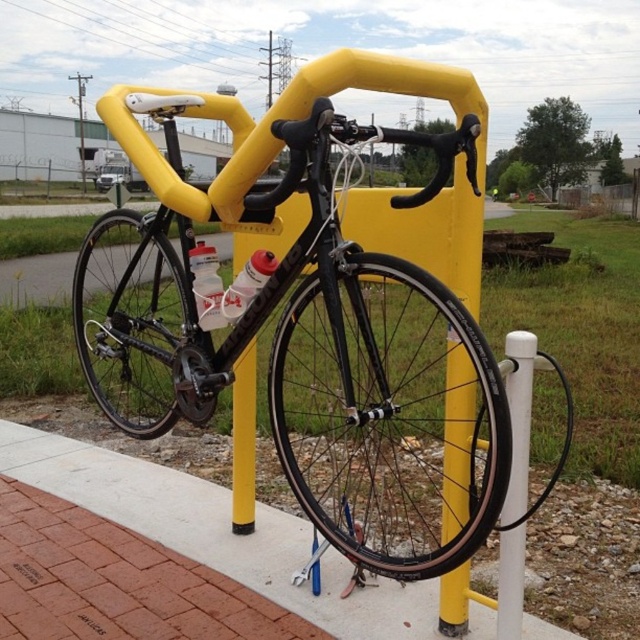
Who is positioned more to the left, matte black bicycle at center or white matte bottle at center?

white matte bottle at center is more to the left.

Can you confirm if matte black bicycle at center is thinner than white matte bottle at center?

Incorrect, matte black bicycle at center's width is not less than white matte bottle at center's.

This screenshot has height=640, width=640. Find the location of `matte black bicycle at center`. matte black bicycle at center is located at coordinates (312, 352).

Which is more to the left, matte black bicycle at center or concrete at lower left?

Positioned to the left is concrete at lower left.

Is matte black bicycle at center bigger than concrete at lower left?

Yes.

Does point (458, 349) lie in front of point (332, 632)?

Yes, point (458, 349) is closer to viewer.

Find the location of a particular element. The height and width of the screenshot is (640, 640). matte black bicycle at center is located at coordinates (312, 352).

Who is shorter, concrete at lower left or white plastic post at lower right?

Standing shorter between the two is concrete at lower left.

Which is more to the right, concrete at lower left or white plastic post at lower right?

Positioned to the right is white plastic post at lower right.

This screenshot has width=640, height=640. What are the coordinates of `concrete at lower left` in the screenshot? It's located at 216,532.